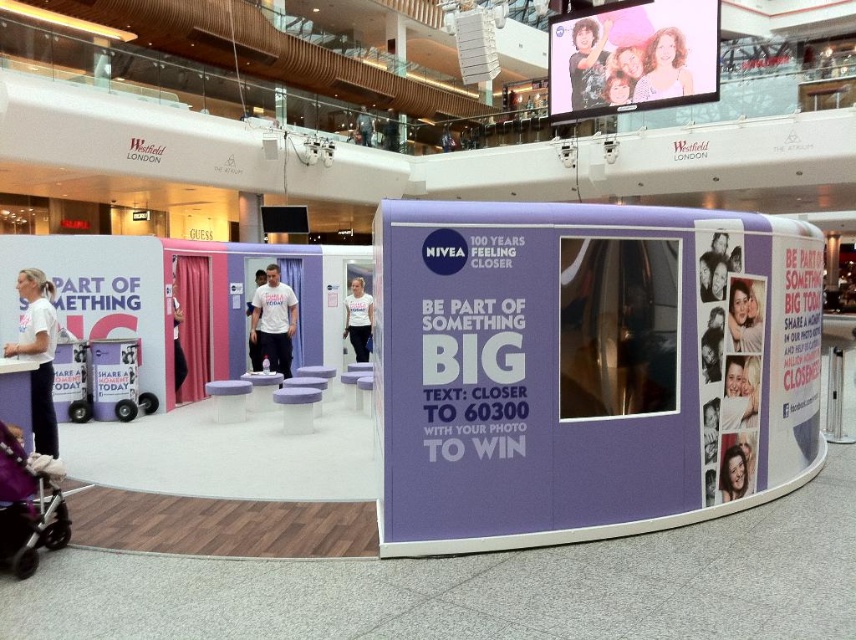
Consider the image. Does purple fabric baby carriage at lower left have a smaller size compared to white matte t-shirt at center?

Correct, purple fabric baby carriage at lower left occupies less space than white matte t-shirt at center.

Is purple fabric baby carriage at lower left below white matte t-shirt at center?

Correct, purple fabric baby carriage at lower left is located below white matte t-shirt at center.

The image size is (856, 640). Identify the location of purple fabric baby carriage at lower left. (27, 508).

Who is taller, white t-shirt at lower left or matte plastic stool at center?

white t-shirt at lower left

Is point (43, 417) positioned in front of point (220, 412)?

Yes.

At what (x,y) coordinates should I click in order to perform the action: click on white t-shirt at lower left. Please return your answer as a coordinate pair (x, y). Image resolution: width=856 pixels, height=640 pixels. Looking at the image, I should click on (37, 355).

Is point (31, 541) positioned in front of point (40, 304)?

Yes, it is.

Consider the image. Does purple fabric baby carriage at lower left have a larger size compared to white t-shirt at lower left?

No, purple fabric baby carriage at lower left is not bigger than white t-shirt at lower left.

Identify the location of purple fabric baby carriage at lower left. This screenshot has width=856, height=640. (27, 508).

This screenshot has height=640, width=856. Find the location of `purple fabric baby carriage at lower left`. purple fabric baby carriage at lower left is located at coordinates (27, 508).